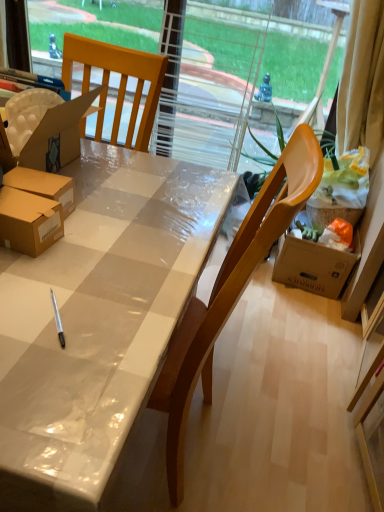
Where is `vacant area on top of white glossy desk at center (from a real-world perspective)`? vacant area on top of white glossy desk at center (from a real-world perspective) is located at coordinates (100, 230).